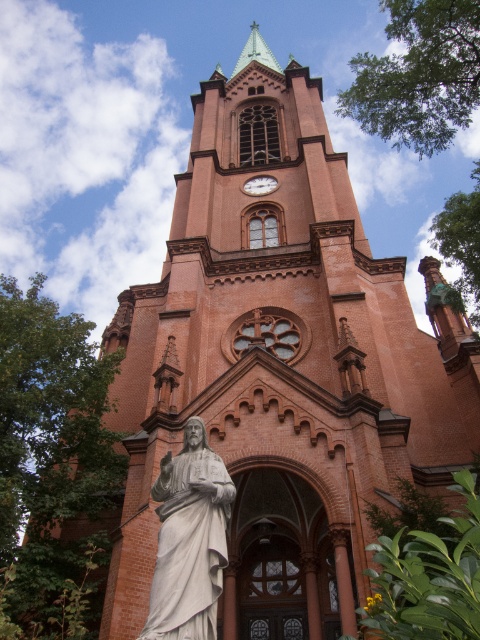
Question: Is white marble statue at center thinner than matte brown clock at center?

Choices:
 (A) yes
 (B) no

Answer: (B)

Question: Which of the following is the farthest from the observer?

Choices:
 (A) (196, 440)
 (B) (244, 189)

Answer: (B)

Question: Does white marble statue at center come behind matte brown clock at center?

Choices:
 (A) no
 (B) yes

Answer: (A)

Question: Among these points, which one is farthest from the camera?

Choices:
 (A) (254, 177)
 (B) (159, 477)

Answer: (A)

Question: Is white marble statue at center positioned in front of matte brown clock at center?

Choices:
 (A) yes
 (B) no

Answer: (A)